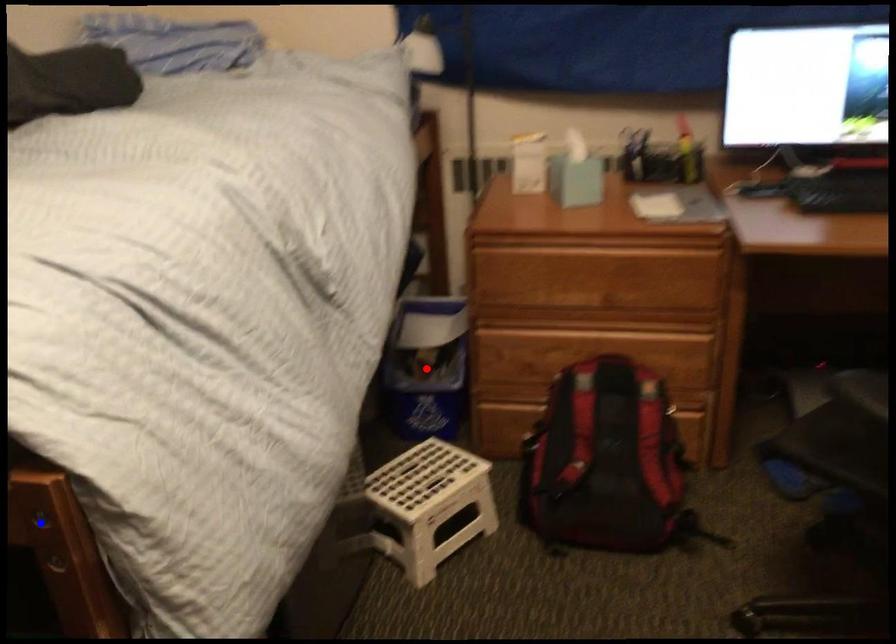
Question: In the image, two points are highlighted. Which point is nearer to the camera? Reply with the corresponding letter.

Choices:
 (A) blue point
 (B) red point

Answer: (A)